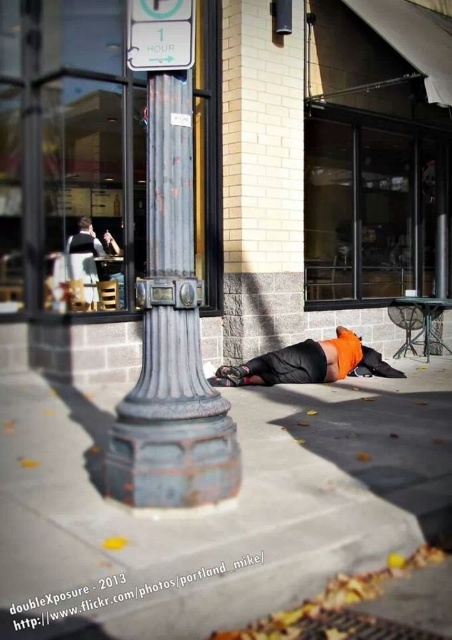
Does brick wall at center appear under gray concrete sidewalk at lower center?

No, brick wall at center is not below gray concrete sidewalk at lower center.

Can you confirm if brick wall at center is wider than gray concrete sidewalk at lower center?

In fact, brick wall at center might be narrower than gray concrete sidewalk at lower center.

Is point (404, 237) more distant than point (352, 436)?

Yes, point (404, 237) is farther from viewer.

The image size is (452, 640). Identify the location of brick wall at center. (320, 163).

Between rusty metal pole at center and white plastic sign at upper center, which one is positioned higher?

white plastic sign at upper center is above.

Between rusty metal pole at center and white plastic sign at upper center, which one appears on the left side from the viewer's perspective?

white plastic sign at upper center

The height and width of the screenshot is (640, 452). What do you see at coordinates (170, 339) in the screenshot?
I see `rusty metal pole at center` at bounding box center [170, 339].

At what (x,y) coordinates should I click in order to perform the action: click on rusty metal pole at center. Please return your answer as a coordinate pair (x, y). Image resolution: width=452 pixels, height=640 pixels. Looking at the image, I should click on (170, 339).

Is gray concrete sidewalk at lower center taller than orange fabric at lower center?

No, gray concrete sidewalk at lower center is not taller than orange fabric at lower center.

Consider the image. Is gray concrete sidewalk at lower center closer to the viewer compared to orange fabric at lower center?

Yes, it is.

Is point (182, 516) closer to viewer compared to point (345, 340)?

Yes, point (182, 516) is in front of point (345, 340).

Where is `gray concrete sidewalk at lower center`? gray concrete sidewalk at lower center is located at coordinates (221, 506).